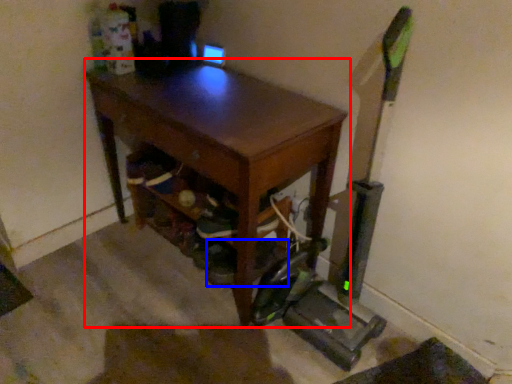
Question: Which object appears farthest to the camera in this image, desk (highlighted by a red box) or shoe (highlighted by a blue box)?

Choices:
 (A) desk
 (B) shoe

Answer: (B)